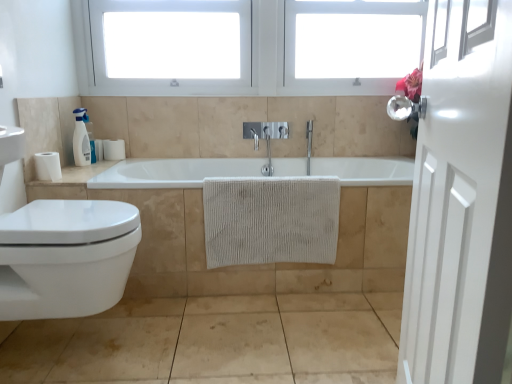
Find the location of a particular element. The height and width of the screenshot is (384, 512). free spot below white glossy toilet at lower left (from a real-world perspective) is located at coordinates (71, 343).